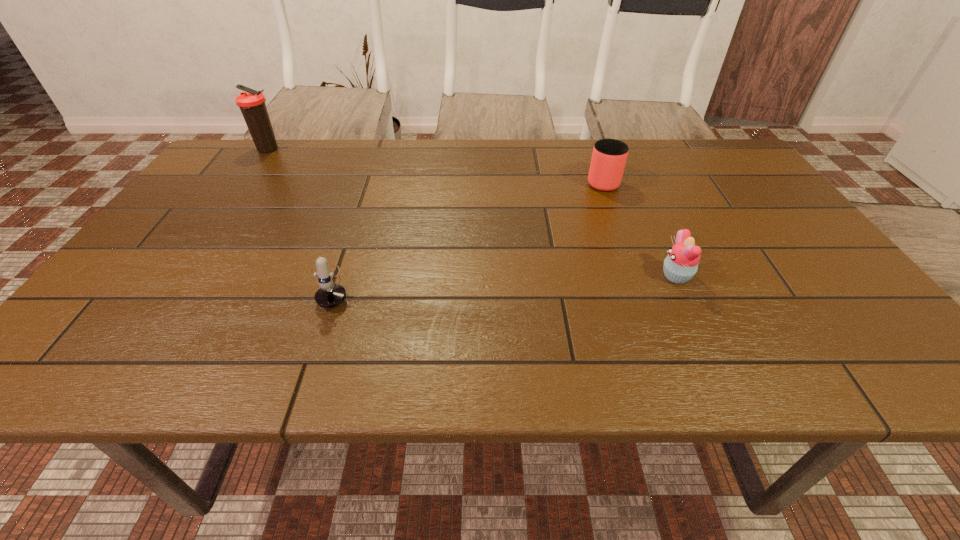
You are a GUI agent. You are given a task and a screenshot of the screen. Output one action in this format:
    pyautogui.click(x=<x>, y=<y>)
    Task: Click on the free space at the left edge
    
    Given the screenshot: What is the action you would take?
    pyautogui.click(x=132, y=264)

In the image, there is a desktop. Identify the location of vacant space at the right edge. Image resolution: width=960 pixels, height=540 pixels. (788, 301).

In the image, there is a desktop. Where is `vacant space at the far left corner`? This screenshot has height=540, width=960. vacant space at the far left corner is located at coordinates (262, 164).

Where is `free space between the thermos bottle and the microphone`? This screenshot has height=540, width=960. free space between the thermos bottle and the microphone is located at coordinates (302, 218).

Find the location of `unoccupied area between the leftmost object and the second object from right to left`. unoccupied area between the leftmost object and the second object from right to left is located at coordinates (435, 165).

This screenshot has height=540, width=960. Find the location of `vacant space that is in between the rightmost object and the thermos bottle`. vacant space that is in between the rightmost object and the thermos bottle is located at coordinates (472, 213).

The height and width of the screenshot is (540, 960). In order to click on unoccupied position between the cupcake and the second object from right to left in this screenshot , I will do `click(639, 228)`.

The height and width of the screenshot is (540, 960). What are the coordinates of `free area in between the cupcake and the thermos bottle` in the screenshot? It's located at (472, 213).

The width and height of the screenshot is (960, 540). I want to click on free point between the rightmost object and the leftmost object, so click(x=472, y=213).

Image resolution: width=960 pixels, height=540 pixels. Identify the location of vacant area between the third object from right to left and the cup. (469, 234).